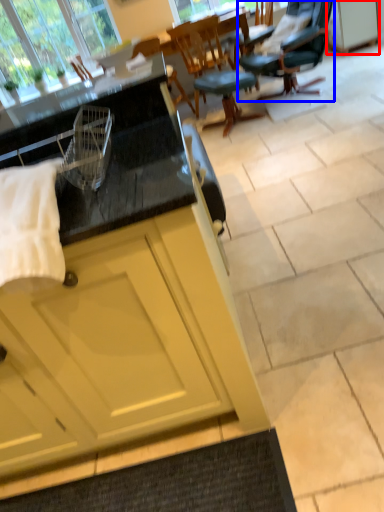
Question: Which point is further to the camera, cabinetry (highlighted by a red box) or chair (highlighted by a blue box)?

Choices:
 (A) cabinetry
 (B) chair

Answer: (A)